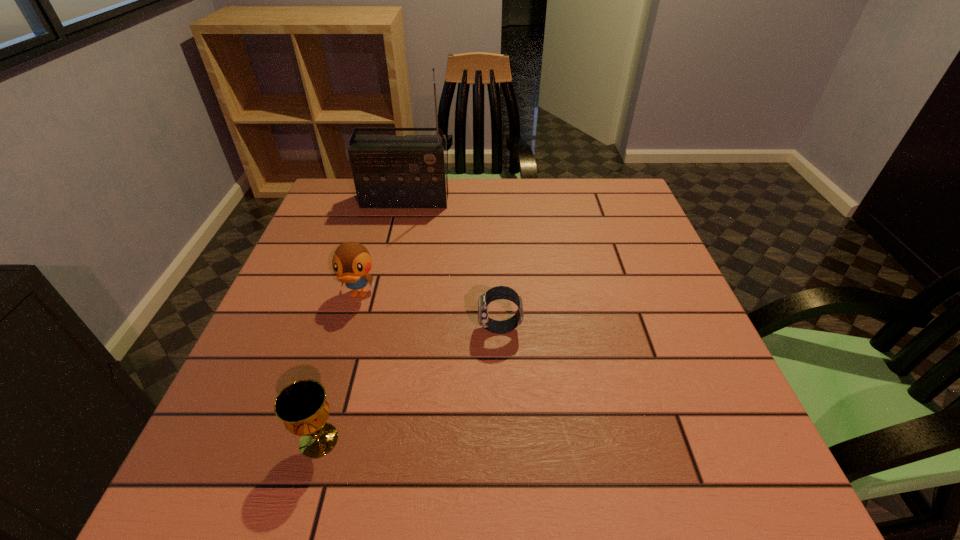
This screenshot has height=540, width=960. I want to click on free point located 0.150m on the face of the second nearest object, so click(407, 329).

Find the location of a particular element. The image size is (960, 540). vacant region located on the face of the second nearest object is located at coordinates (440, 329).

I want to click on object located in the far edge section of the desktop, so click(389, 171).

Locate an element on the screen. This screenshot has width=960, height=540. object located in the near edge section of the desktop is located at coordinates (302, 406).

I want to click on radio receiver that is at the left edge, so click(389, 171).

Where is `duck located in the left edge section of the desktop`? The image size is (960, 540). duck located in the left edge section of the desktop is located at coordinates (352, 262).

Locate an element on the screen. chalice located in the left edge section of the desktop is located at coordinates (302, 406).

Find the location of `object situated at the far left corner`. object situated at the far left corner is located at coordinates (389, 171).

The height and width of the screenshot is (540, 960). Identify the location of object positioned at the near left corner. (302, 406).

Where is `vacant area at the far edge of the desktop`? Image resolution: width=960 pixels, height=540 pixels. vacant area at the far edge of the desktop is located at coordinates (463, 208).